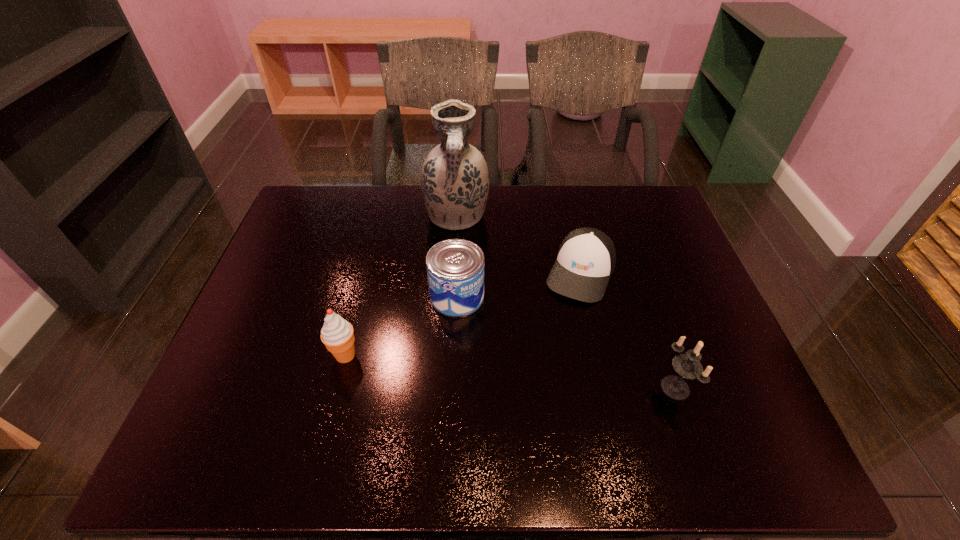
Identify the location of vacant space located on the left of the candle holder. (x=626, y=387).

At what (x,y) coordinates should I click in order to perform the action: click on vacant region located 0.110m on the front panel of the second object from right to left. Please return your answer as a coordinate pair (x, y). Looking at the image, I should click on (559, 333).

At what (x,y) coordinates should I click in order to perform the action: click on blank area located 0.190m on the front panel of the second object from right to left. Please return your answer as a coordinate pair (x, y). Image resolution: width=960 pixels, height=540 pixels. Looking at the image, I should click on (548, 357).

Identify the location of free region located on the front panel of the second object from right to left. This screenshot has height=540, width=960. (536, 388).

This screenshot has width=960, height=540. In order to click on free space located 0.050m with the handle on the side of the vase in this screenshot , I will do `click(461, 251)`.

Where is `vacant space located with the handle on the side of the vase`? vacant space located with the handle on the side of the vase is located at coordinates (463, 267).

In order to click on free space located 0.110m with the handle on the side of the vase in this screenshot , I will do `click(463, 265)`.

The height and width of the screenshot is (540, 960). In order to click on free space located 0.290m on the front label of the can in this screenshot , I will do tap(534, 404).

Locate an element on the screen. The width and height of the screenshot is (960, 540). blank area located on the front label of the can is located at coordinates (498, 354).

The height and width of the screenshot is (540, 960). Identify the location of vacant space located on the front label of the can. (512, 373).